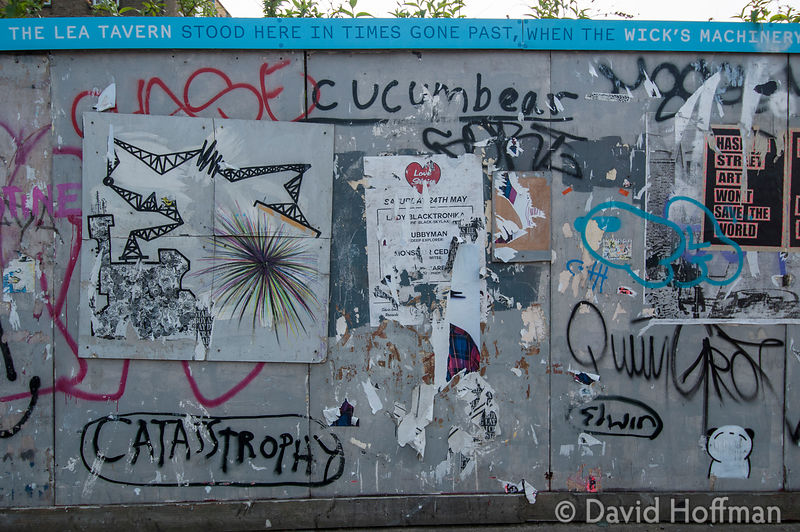
Image resolution: width=800 pixels, height=532 pixels. Find the location of `base of wall`. base of wall is located at coordinates (373, 511).